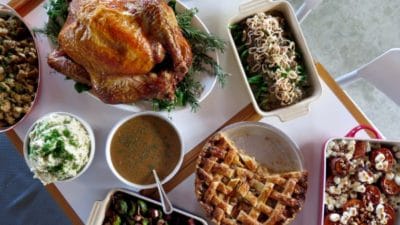
Identify the location of platter. (207, 86).